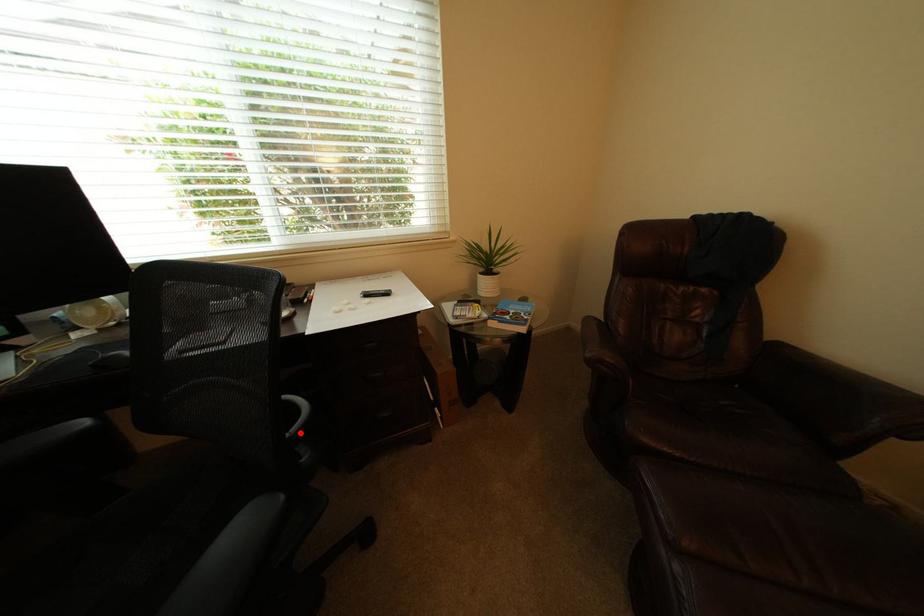
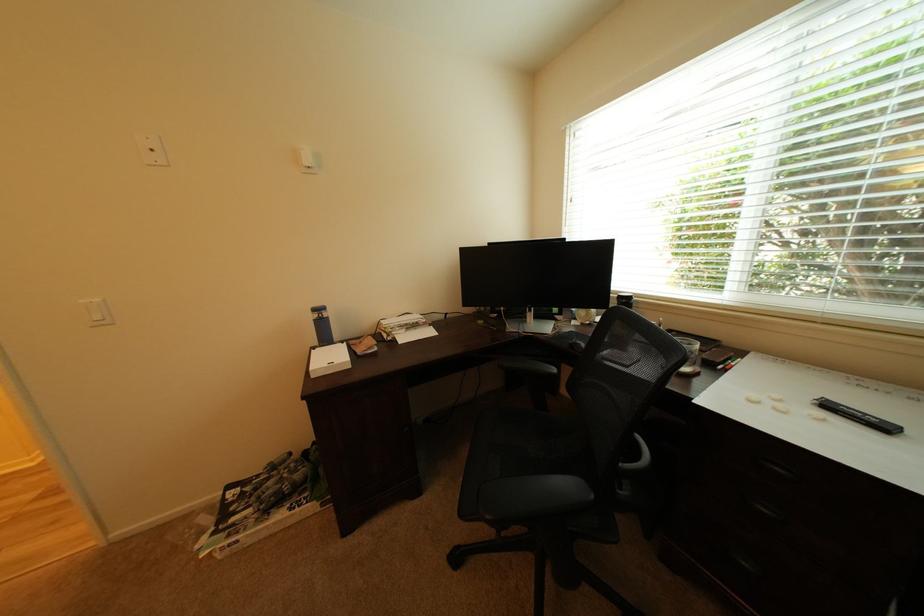
Question: I am providing you with two images of the same scene from different viewpoints. A red point is marked on the first image. Is the red point's position out of view in image 2?

Choices:
 (A) Yes
 (B) No

Answer: (B)